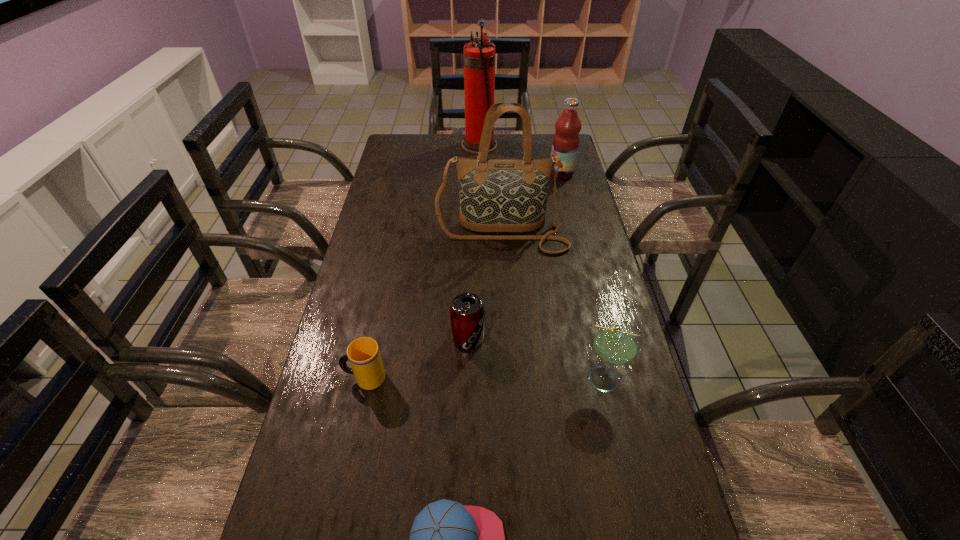
This screenshot has width=960, height=540. Identify the location of the farthest object. (479, 56).

Find the location of `the second tallest object`. the second tallest object is located at coordinates (495, 195).

Identify the location of handbag. (495, 195).

I want to click on the fifth shortest object, so click(x=565, y=144).

You are a GUI agent. You are given a task and a screenshot of the screen. Output one action in this format:
    pyautogui.click(x=<x>, y=<y>)
    Task: Click on the sixth nearest object
    Image resolution: width=960 pixels, height=540 pixels.
    Given the screenshot: What is the action you would take?
    pyautogui.click(x=565, y=144)

This screenshot has height=540, width=960. In order to click on martini in this screenshot , I will do `click(615, 344)`.

Locate an element on the screen. The width and height of the screenshot is (960, 540). the fourth farthest object is located at coordinates (467, 310).

Locate an element on the screen. the sixth tallest object is located at coordinates (363, 353).

At what (x,y) coordinates should I click in order to perform the action: click on cup. Please return your answer as a coordinate pair (x, y). Looking at the image, I should click on (363, 353).

This screenshot has width=960, height=540. Find the location of `vacant space located 0.320m at the discharge end of the fire extinguisher`. vacant space located 0.320m at the discharge end of the fire extinguisher is located at coordinates (570, 145).